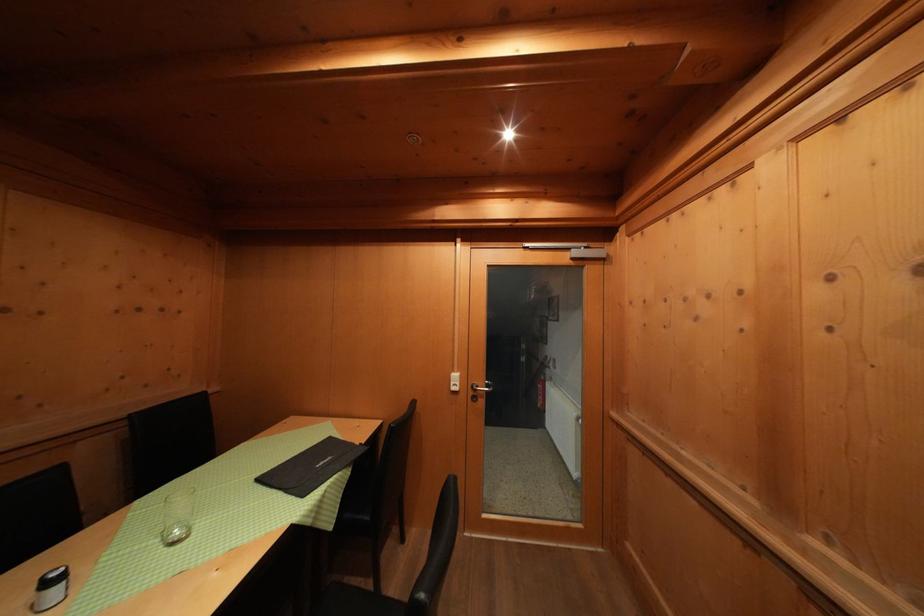
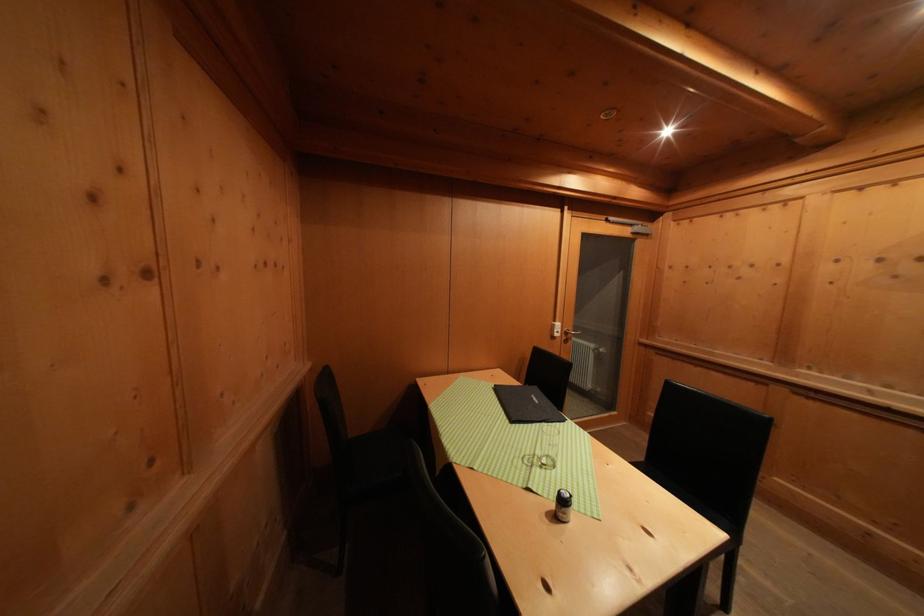
Find the pixel in the second image that matches (459,377) in the first image.

(561, 326)